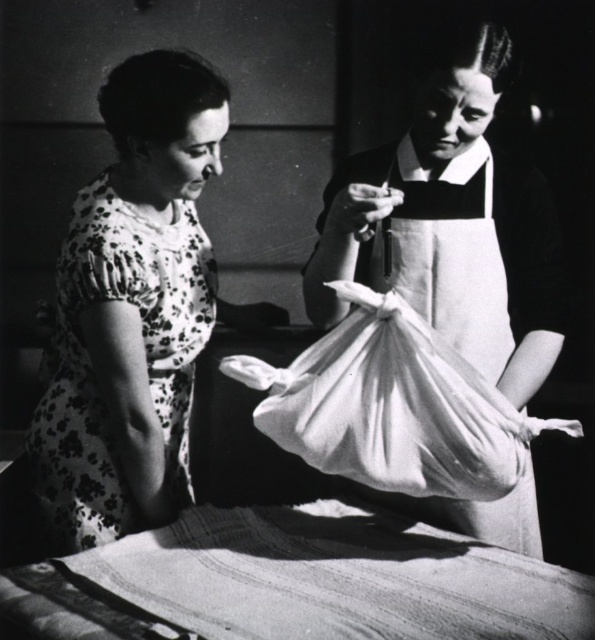
You are a tailor in a workshop. You need to place a new fabric roll to the right of the existing white fabric at center. Where should you place the new fabric roll relative to the floral print dress at left?

The floral print dress at left is positioned on the left side of white fabric at center. Therefore, placing the new fabric roll to the right of the white fabric at center would place it further to the right of the floral print dress at left.

You are a tailor working in a small room that is 10 feet wide. You need to place the white fabric bag at center and the floral print dress at left on a worktable. Can both items fit side by side on the table without overlapping?

The white fabric bag at center is 13.42 inches from the floral print dress at left. Since 13.42 inches is less than 120 inches, the total width required would be the sum of their individual widths plus the distance between them. However, the problem does not provide the widths of the items themselves, so it is impossible to determine if they can fit side by side on the table without overlapping.